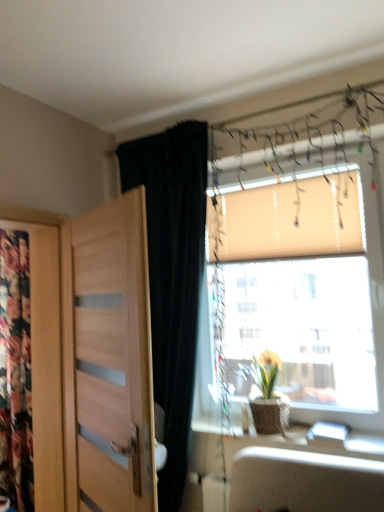
Question: Would you say wooden blinds at upper right is part of black velvet curtain at left's contents?

Choices:
 (A) no
 (B) yes

Answer: (A)

Question: From the image's perspective, would you say black velvet curtain at left is shown under wooden blinds at upper right?

Choices:
 (A) yes
 (B) no

Answer: (A)

Question: Considering the relative positions of black velvet curtain at left and wooden blinds at upper right in the image provided, is black velvet curtain at left to the left of wooden blinds at upper right from the viewer's perspective?

Choices:
 (A) no
 (B) yes

Answer: (B)

Question: Is there a large distance between black velvet curtain at left and wooden blinds at upper right?

Choices:
 (A) yes
 (B) no

Answer: (B)

Question: Is black velvet curtain at left oriented away from wooden blinds at upper right?

Choices:
 (A) no
 (B) yes

Answer: (A)

Question: From a real-world perspective, is black velvet curtain at left above or below floral fabric at left?

Choices:
 (A) above
 (B) below

Answer: (A)

Question: Is black velvet curtain at left inside the boundaries of floral fabric at left, or outside?

Choices:
 (A) outside
 (B) inside

Answer: (A)

Question: Considering the positions of black velvet curtain at left and floral fabric at left in the image, is black velvet curtain at left wider or thinner than floral fabric at left?

Choices:
 (A) wide
 (B) thin

Answer: (A)

Question: Considering the positions of point (140, 163) and point (6, 380), is point (140, 163) closer or farther from the camera than point (6, 380)?

Choices:
 (A) closer
 (B) farther

Answer: (A)

Question: From the image's perspective, relative to beige fabric blind at upper right, is wooden blinds at upper right above or below?

Choices:
 (A) below
 (B) above

Answer: (A)

Question: In terms of width, does wooden blinds at upper right look wider or thinner when compared to beige fabric blind at upper right?

Choices:
 (A) thin
 (B) wide

Answer: (B)

Question: From a real-world perspective, is wooden blinds at upper right above or below beige fabric blind at upper right?

Choices:
 (A) above
 (B) below

Answer: (B)

Question: Is wooden blinds at upper right inside the boundaries of beige fabric blind at upper right, or outside?

Choices:
 (A) outside
 (B) inside

Answer: (A)

Question: Do you think wooden blinds at upper right is within floral fabric at left, or outside of it?

Choices:
 (A) outside
 (B) inside

Answer: (A)

Question: From the image's perspective, is wooden blinds at upper right above or below floral fabric at left?

Choices:
 (A) below
 (B) above

Answer: (B)